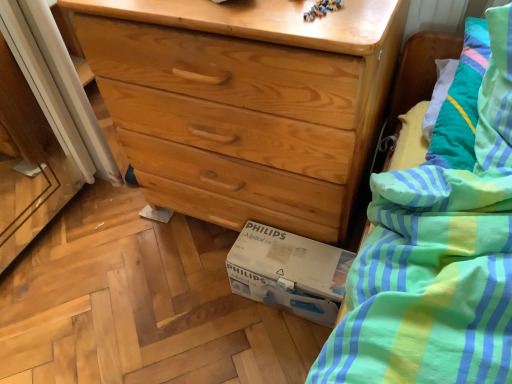
In order to click on free area in between natural wood chest of drawers at center and white cardboard box at lower center in this screenshot , I will do click(193, 258).